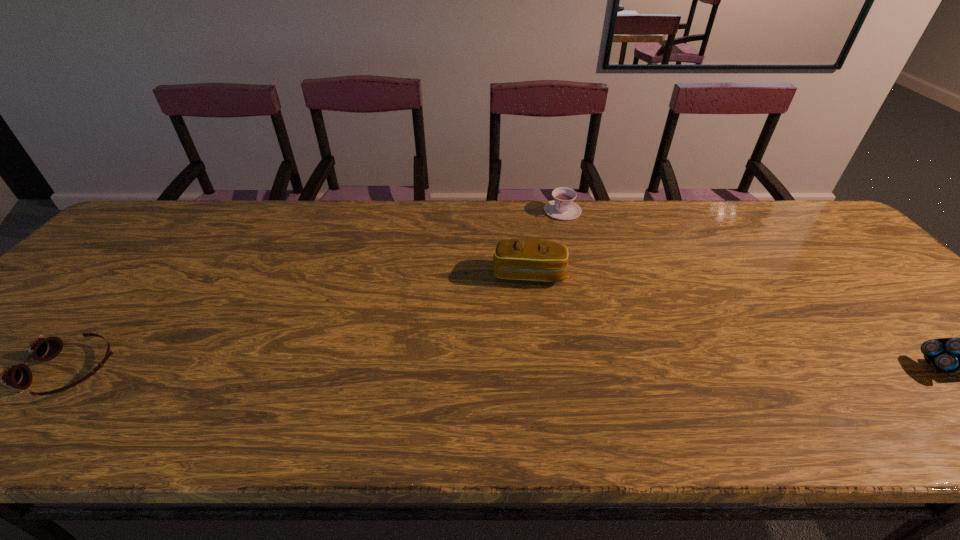
Locate an element on the screen. vacant space on the desktop that is between the shortest object and the electric shaver and is positioned on the zipper side of the clutch bag is located at coordinates (518, 369).

I want to click on free space on the desktop that is between the shortest object and the electric shaver and is positioned on the handle side of the farthest object, so click(x=485, y=369).